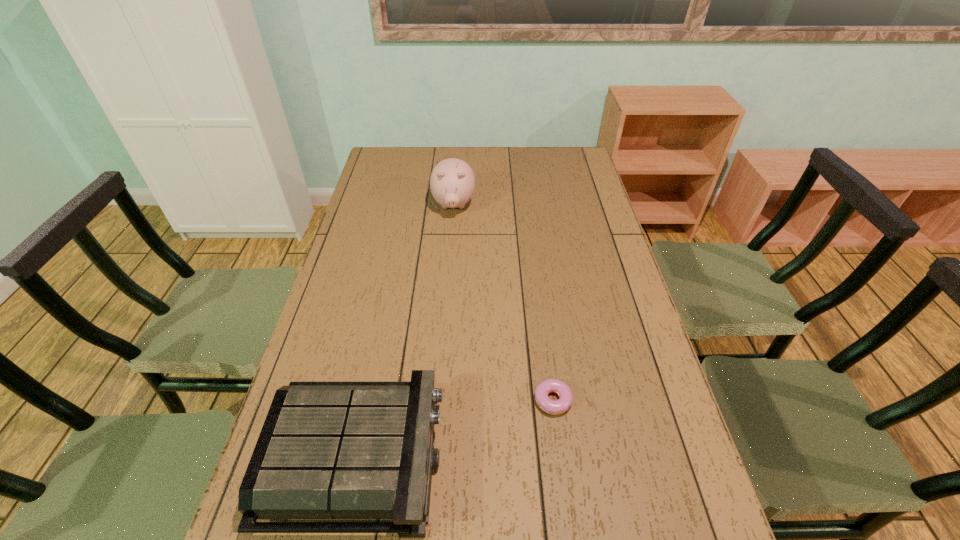
Where is `piggy bank`? This screenshot has height=540, width=960. piggy bank is located at coordinates (452, 182).

Find the location of a particular element. the tallest object is located at coordinates (452, 182).

Where is `doughnut`? The height and width of the screenshot is (540, 960). doughnut is located at coordinates (554, 407).

This screenshot has height=540, width=960. What are the coordinates of `the shortest object` in the screenshot? It's located at (554, 407).

Locate an element on the screen. free space located 0.130m at the snout of the piggy bank is located at coordinates (450, 246).

Find the location of a particular element. vacant space located 0.370m on the left of the rightmost object is located at coordinates coord(382,399).

Locate an element on the screen. vacant region at the left edge of the desktop is located at coordinates (367, 210).

Identify the location of vacant space at the right edge of the desktop. Image resolution: width=960 pixels, height=540 pixels. (558, 203).

Image resolution: width=960 pixels, height=540 pixels. In the image, there is a desktop. In order to click on vacant space at the far left corner in this screenshot , I will do `click(395, 168)`.

The image size is (960, 540). I want to click on free space between the farthest object and the shortest object, so click(503, 302).